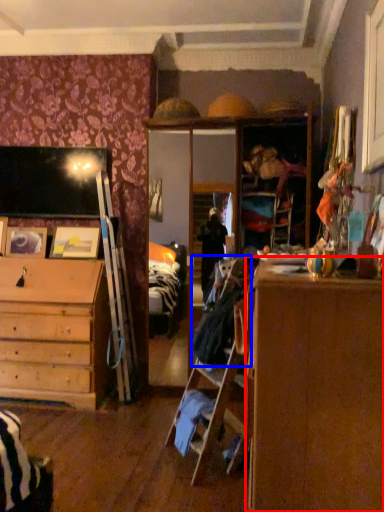
Question: Which of the following is the closest to the observer, cabinetry (highlighted by a red box) or laundry (highlighted by a blue box)?

Choices:
 (A) cabinetry
 (B) laundry

Answer: (A)